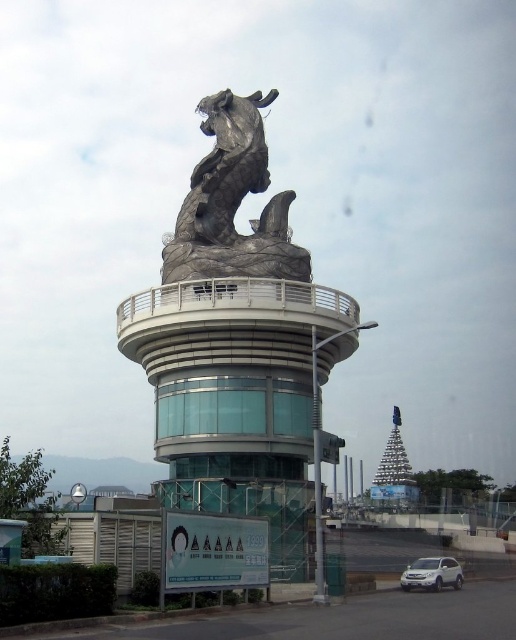
Is shiny silver horse at center above white matte suv at lower center?

Yes.

Can you confirm if shiny silver horse at center is positioned below white matte suv at lower center?

Actually, shiny silver horse at center is above white matte suv at lower center.

At what (x,y) coordinates should I click in order to perform the action: click on shiny silver horse at center. Please return your answer as a coordinate pair (x, y). This screenshot has height=640, width=516. Looking at the image, I should click on (233, 202).

Who is taller, shiny silver pagoda at center or white matte suv at lower center?

Standing taller between the two is shiny silver pagoda at center.

Can you confirm if shiny silver pagoda at center is positioned to the right of white matte suv at lower center?

Correct, you'll find shiny silver pagoda at center to the right of white matte suv at lower center.

Does point (374, 488) lie in front of point (436, 566)?

No, it is not.

This screenshot has width=516, height=640. Identify the location of shiny silver pagoda at center. (395, 472).

Which of these two, shiny silver horse at center or shiny silver pagoda at center, stands shorter?

shiny silver pagoda at center is shorter.

Does shiny silver horse at center appear on the left side of shiny silver pagoda at center?

Yes, shiny silver horse at center is to the left of shiny silver pagoda at center.

Who is more forward, (215, 116) or (378, 476)?

Point (215, 116) is more forward.

Where is `shiny silver horse at center`? The width and height of the screenshot is (516, 640). shiny silver horse at center is located at coordinates (233, 202).